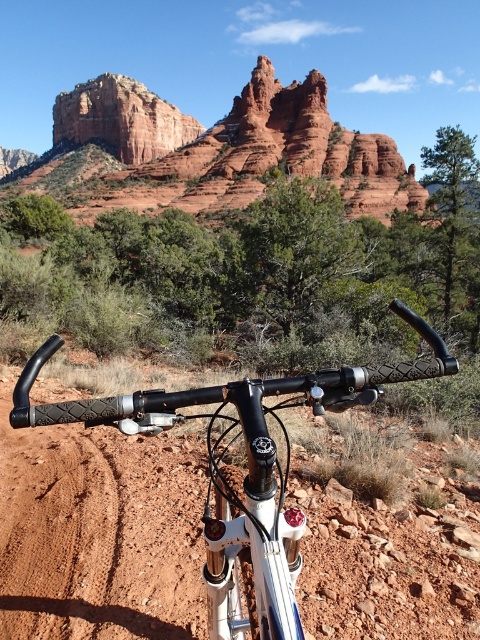
From the picture: Is reddish-brown rock formation at upper center wider than rubber textured handlebars at center?

Indeed, reddish-brown rock formation at upper center has a greater width compared to rubber textured handlebars at center.

Does reddish-brown rock formation at upper center appear on the right side of rubber textured handlebars at center?

In fact, reddish-brown rock formation at upper center is to the left of rubber textured handlebars at center.

At what (x,y) coordinates should I click in order to perform the action: click on reddish-brown rock formation at upper center. Please return your answer as a coordinate pair (x, y). This screenshot has width=480, height=640. Looking at the image, I should click on (217, 154).

The width and height of the screenshot is (480, 640). I want to click on reddish-brown rock formation at upper center, so click(x=217, y=154).